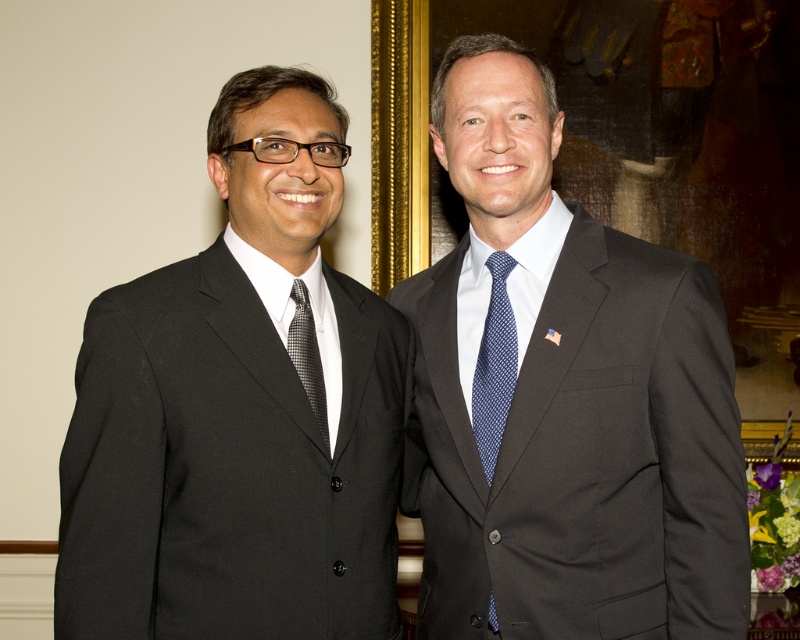
You are a photographer taking a portrait of two men. You notice the blue dotted tie at center and the black textured tie at left. Which tie is located to the right of the other?

The blue dotted tie at center is positioned on the right side of the black textured tie at left.

You are a photographer setting up for a group photo. You need to arrange the matte black suit at right and the black matte suit at left so that both are visible in the frame. Considering their heights, which one should you position closer to the camera to ensure their faces are equally visible?

The matte black suit at right is taller than the black matte suit at left. To make their faces equally visible, position the black matte suit at left closer to the camera since they are shorter.

You are an artist analyzing the composition of this image. There are two points marked in the scene, one at point (504,284) and the other at point (324,417). Which of these points is closer to the viewer?

Point (504,284) is closer to the viewer than point (324,417).